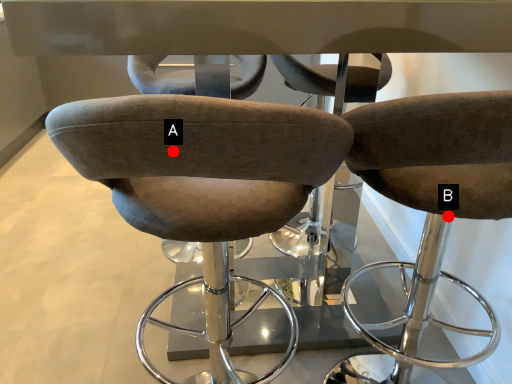
Question: Two points are circled on the image, labeled by A and B beside each circle. Which point is closer to the camera?

Choices:
 (A) A is closer
 (B) B is closer

Answer: (A)